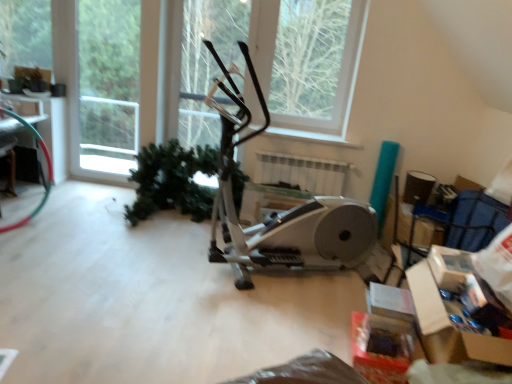
What do you see at coordinates (108, 84) in the screenshot? I see `white plastic window frame at upper left` at bounding box center [108, 84].

What do you see at coordinates (286, 217) in the screenshot? I see `silver metallic stationary bicycle at center` at bounding box center [286, 217].

Measure the distance between cardboard box at lower right and camera.

They are 1.54 meters apart.

Describe the element at coordinates (37, 141) in the screenshot. Image resolution: width=512 pixels, height=384 pixels. I see `wooden table at left` at that location.

Image resolution: width=512 pixels, height=384 pixels. I want to click on white plastic window frame at upper left, so click(108, 84).

Is point (133, 39) in front of point (236, 203)?

No.

Would you say white plastic window frame at upper left contains green matte plant at center?

No, green matte plant at center is not a part of white plastic window frame at upper left.

How distant is white plastic window frame at upper left from green matte plant at center?

5.17 feet.

From the picture: Which of these two, white plastic window frame at upper left or green matte plant at center, is bigger?

green matte plant at center.

How many degrees apart are the facing directions of wooden table at left and green matte plant at center?

The angle between the facing direction of wooden table at left and the facing direction of green matte plant at center is 1.36 degrees.

From the image's perspective, would you say wooden table at left is positioned over green matte plant at center?

Yes.

Based on the photo, can you confirm if wooden table at left is positioned to the left of green matte plant at center?

Correct, you'll find wooden table at left to the left of green matte plant at center.

Could you tell me if wooden table at left is facing green matte plant at center?

No, wooden table at left is not facing towards green matte plant at center.

Would you consider wooden table at left to be distant from green matte tree at upper left, placed as the 1th tree when sorted from left to right?

No.

Considering the relative sizes of wooden table at left and green matte tree at upper left, placed as the 1th tree when sorted from left to right, in the image provided, is wooden table at left wider than green matte tree at upper left, placed as the 1th tree when sorted from left to right,?

Indeed, wooden table at left has a greater width compared to green matte tree at upper left, placed as the 1th tree when sorted from left to right.

Considering the relative sizes of wooden table at left and green matte tree at upper left, positioned as the second tree in right-to-left order, in the image provided, is wooden table at left taller than green matte tree at upper left, positioned as the second tree in right-to-left order,?

No.

From the picture: Is wooden table at left at the right side of green matte tree at upper left, positioned as the second tree in right-to-left order?

Incorrect, wooden table at left is not on the right side of green matte tree at upper left, positioned as the second tree in right-to-left order.

Is white plastic window frame at upper left facing towards silver metallic stationary bicycle at center?

No.

From the image's perspective, which one is positioned lower, white plastic window frame at upper left or silver metallic stationary bicycle at center?

From the image's view, silver metallic stationary bicycle at center is below.

Based on the photo, considering the positions of objects white plastic window frame at upper left and silver metallic stationary bicycle at center in the image provided, who is in front, white plastic window frame at upper left or silver metallic stationary bicycle at center?

silver metallic stationary bicycle at center is more forward.

Considering the relative sizes of white plastic window frame at upper left and silver metallic stationary bicycle at center in the image provided, is white plastic window frame at upper left taller than silver metallic stationary bicycle at center?

Yes, white plastic window frame at upper left is taller than silver metallic stationary bicycle at center.

From a real-world perspective, which object stands above the other?

cardboard box at lower right.

Relative to green matte plant at center, is cardboard box at lower right in front or behind?

In the image, cardboard box at lower right appears in front of green matte plant at center.

Based on their sizes in the image, would you say cardboard box at lower right is bigger or smaller than green matte plant at center?

Clearly, cardboard box at lower right is smaller in size than green matte plant at center.

From the image's perspective, is cardboard box at lower right above or below green matte plant at center?

From the image's perspective, cardboard box at lower right appears below green matte plant at center.

From the image's perspective, which object appears higher, green matte plant at center or cardboard box at lower right?

green matte plant at center, from the image's perspective.

Is point (181, 202) closer or farther from the camera than point (452, 257)?

Point (181, 202) is farther from the camera than point (452, 257).

Is the position of green matte plant at center less distant than that of cardboard box at lower right?

That is False.

Is green matte plant at center oriented away from cardboard box at lower right?

No.

From a real-world perspective, does wooden table at left stand above white plastic radiator at center?

No, from a real-world perspective, wooden table at left is not over white plastic radiator at center

Can you confirm if wooden table at left is positioned to the left of white plastic radiator at center?

Yes.

From the image's perspective, is wooden table at left below white plastic radiator at center?

No.

Identify the location of radiator behind the wooden table at left. The height and width of the screenshot is (384, 512). [302, 172].

You are a GUI agent. You are given a task and a screenshot of the screen. Output one action in this format:
    pyautogui.click(x=<x>, y=<y>)
    Task: Click on the window frame on the left of green matte plant at center
    This screenshot has height=384, width=512.
    Given the screenshot: What is the action you would take?
    pyautogui.click(x=108, y=84)

Find the location of `table above the green matte plant at center (from a real-world perspective)`. table above the green matte plant at center (from a real-world perspective) is located at coordinates (37, 141).

Based on their spatial positions, is silver metallic stationary bicycle at center or green matte tree at upper left, placed as the 1th tree when sorted from left to right, closer to wooden table at left?

green matte tree at upper left, placed as the 1th tree when sorted from left to right.

Considering their positions, is white plastic window frame at upper left positioned closer to green matte tree at upper left, placed as the 1th tree when sorted from left to right, than green matte tree at upper center, which is the first tree in right-to-left order?

Among the two, white plastic window frame at upper left is located nearer to green matte tree at upper left, placed as the 1th tree when sorted from left to right.

Based on their spatial positions, is wooden table at left or green matte tree at upper left, placed as the 1th tree when sorted from left to right, closer to silver metallic stationary bicycle at center?

wooden table at left.

Estimate the real-world distances between objects in this image. Which object is closer to cardboard box at lower right, green matte plant at center or green matte tree at upper left, placed as the 1th tree when sorted from left to right?

The object closer to cardboard box at lower right is green matte plant at center.

Based on the photo, looking at the image, which one is located closer to white plastic radiator at center, silver metallic stationary bicycle at center or green matte plant at center?

green matte plant at center is positioned closer to the anchor white plastic radiator at center.

When comparing their distances from white plastic window frame at upper left, does green matte tree at upper center, the 2th tree when ordered from left to right, or wooden table at left seem closer?

wooden table at left lies closer to white plastic window frame at upper left than the other object.

In the scene shown: Looking at the image, which one is located further to white plastic window frame at upper left, cardboard box at lower right or silver metallic stationary bicycle at center?

Among the two, cardboard box at lower right is located further to white plastic window frame at upper left.

From the picture: Estimate the real-world distances between objects in this image. Which object is further from cardboard box at lower right, green matte tree at upper center, the 2th tree when ordered from left to right, or green matte plant at center?

Based on the image, green matte tree at upper center, the 2th tree when ordered from left to right, appears to be further to cardboard box at lower right.

What are the coordinates of `tree between wooden table at left and white plastic radiator at center` in the screenshot? It's located at [x=25, y=35].

You are a GUI agent. You are given a task and a screenshot of the screen. Output one action in this format:
    pyautogui.click(x=<x>, y=<y>)
    Task: Click on the plant between green matte tree at upper left, placed as the 1th tree when sorted from left to right, and white plastic radiator at center
    
    Given the screenshot: What is the action you would take?
    pyautogui.click(x=172, y=181)

Where is `window frame between green matte tree at upper left, placed as the 1th tree when sorted from left to right, and wooden table at left, in the vertical direction`? This screenshot has width=512, height=384. window frame between green matte tree at upper left, placed as the 1th tree when sorted from left to right, and wooden table at left, in the vertical direction is located at coordinates (108, 84).

Find the location of a particular element. The height and width of the screenshot is (384, 512). plant between green matte tree at upper left, positioned as the second tree in right-to-left order, and silver metallic stationary bicycle at center, in the horizontal direction is located at coordinates (172, 181).